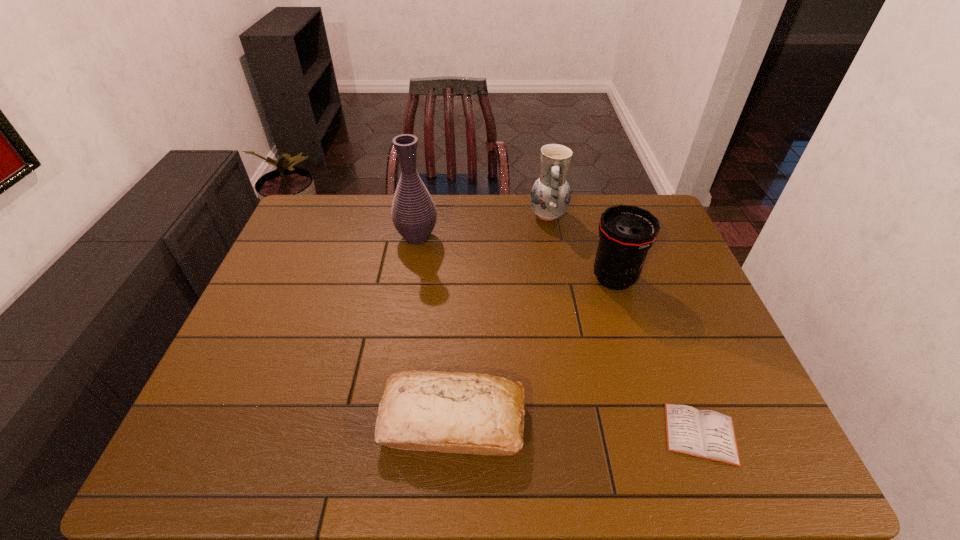
Where is `blank area located 0.050m on either side of the second tallest object`? The image size is (960, 540). blank area located 0.050m on either side of the second tallest object is located at coordinates (515, 215).

Image resolution: width=960 pixels, height=540 pixels. I want to click on vacant space located on the left of the third farthest object, so [538, 278].

The image size is (960, 540). In order to click on vacant region located on the right of the fourth tallest object in this screenshot , I will do `click(659, 421)`.

Where is `vacant space positioned on the left of the shortest object`? Image resolution: width=960 pixels, height=540 pixels. vacant space positioned on the left of the shortest object is located at coordinates (603, 434).

I want to click on vase present at the far edge, so click(x=414, y=215).

Image resolution: width=960 pixels, height=540 pixels. In order to click on pottery that is at the far edge in this screenshot , I will do `click(550, 196)`.

I want to click on bread that is at the near edge, so click(x=466, y=413).

At what (x,y) coordinates should I click in order to perform the action: click on diary located in the near edge section of the desktop. Please return your answer as a coordinate pair (x, y). This screenshot has height=540, width=960. Looking at the image, I should click on (706, 434).

The width and height of the screenshot is (960, 540). Identify the location of telephoto lens that is at the right edge. (626, 232).

You are a GUI agent. You are given a task and a screenshot of the screen. Output one action in this format:
    pyautogui.click(x=<x>, y=<y>)
    Task: Click on the diary located at the right edge
    
    Given the screenshot: What is the action you would take?
    pyautogui.click(x=706, y=434)